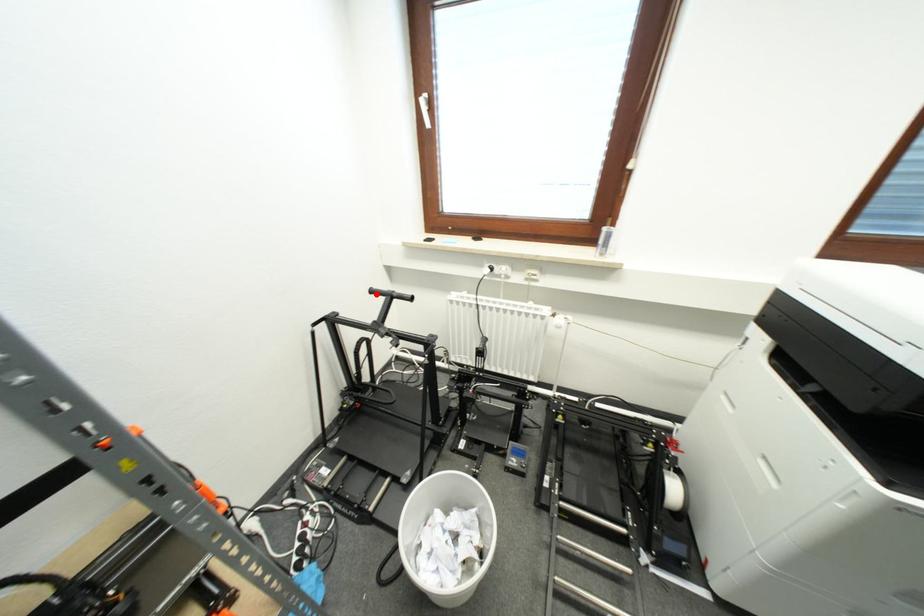
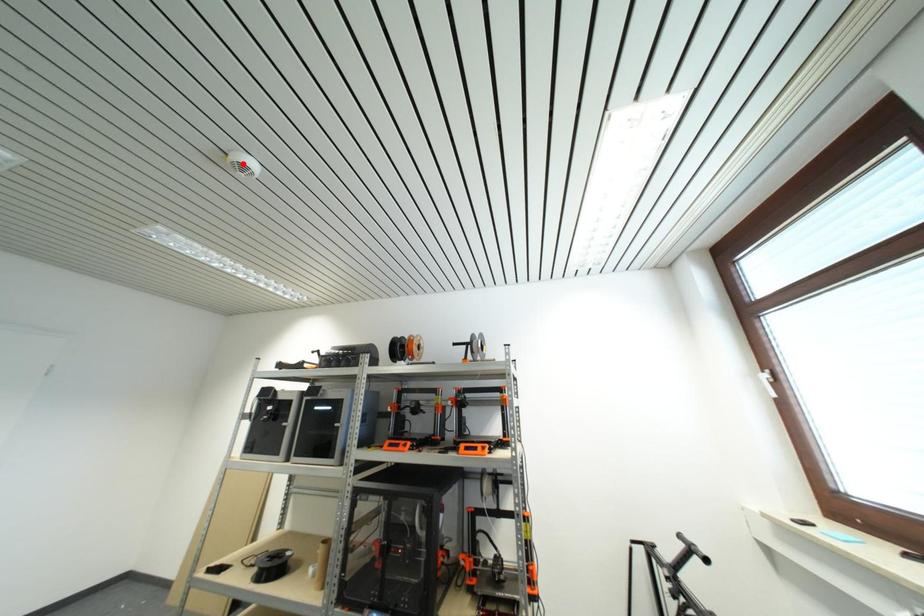
I am providing you with two images of the same scene from different viewpoints. A red point is marked on the first image and another point is marked on the second image. Does the point marked in image1 correspond to the same location as the one in image2?

No